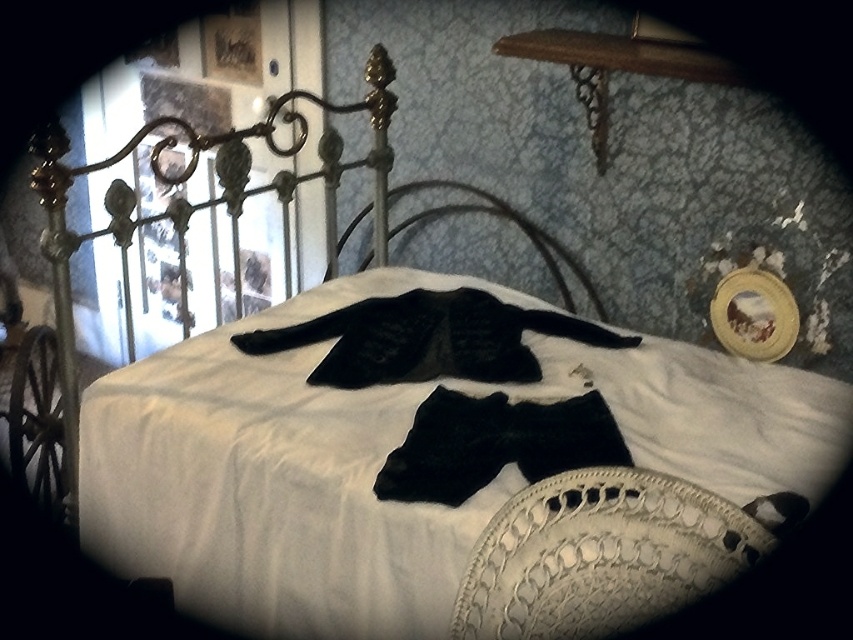
Question: Which of these objects is positioned farthest from the black fuzzy coat at center?

Choices:
 (A) white lace pillow at lower right
 (B) black matte iron bed at center

Answer: (A)

Question: Which object appears farthest from the camera in this image?

Choices:
 (A) black velvet bow tie at center
 (B) black matte iron bed at center
 (C) white lace pillow at lower right

Answer: (B)

Question: Can you confirm if white lace pillow at lower right is smaller than black matte iron bed at center?

Choices:
 (A) yes
 (B) no

Answer: (A)

Question: From the image, what is the correct spatial relationship of black fuzzy coat at center in relation to black matte iron bed at center?

Choices:
 (A) left
 (B) right

Answer: (B)

Question: Which object appears closest to the camera in this image?

Choices:
 (A) black fuzzy coat at center
 (B) black matte iron bed at center
 (C) black velvet bow tie at center

Answer: (C)

Question: Is white lace pillow at lower right bigger than black velvet bow tie at center?

Choices:
 (A) yes
 (B) no

Answer: (B)